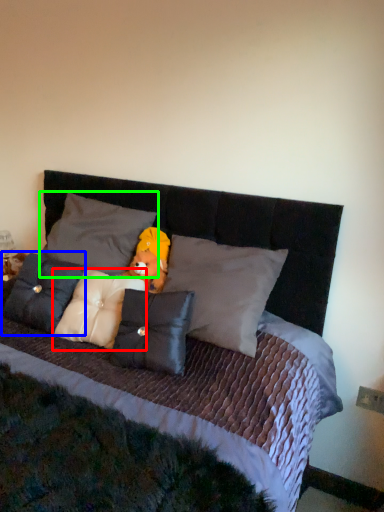
Question: Which is nearer to the pillow (highlighted by a red box)? pillow (highlighted by a blue box) or pillow (highlighted by a green box).

Choices:
 (A) pillow
 (B) pillow

Answer: (A)